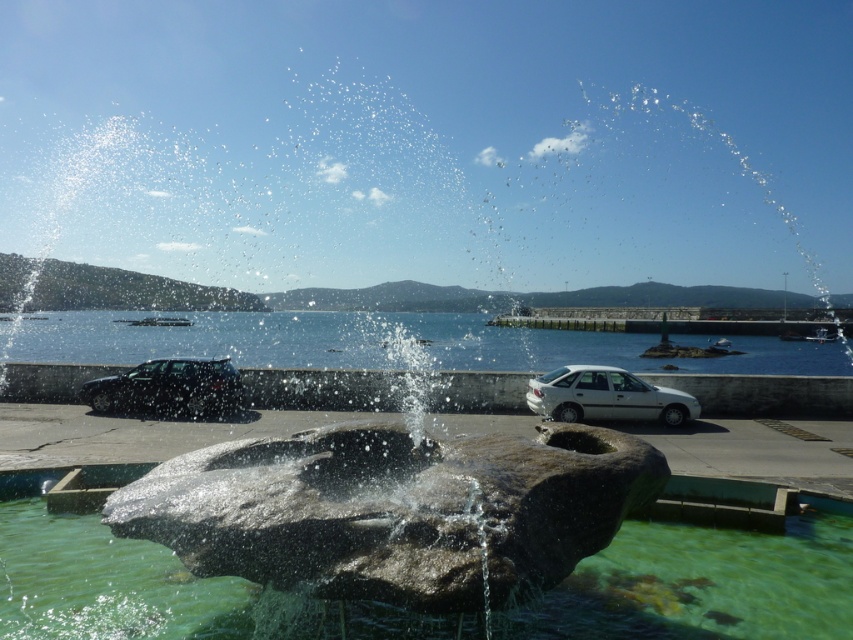
Is the position of rough stone fountain at center more distant than that of clear stone water at center?

Yes, rough stone fountain at center is behind clear stone water at center.

Who is more forward, (242, 486) or (149, 557)?

Point (242, 486)

Does point (486, 506) lie behind point (714, 586)?

No, it is in front of (714, 586).

Identify the location of rough stone fountain at center. This screenshot has height=640, width=853. (393, 509).

Who is more forward, [323,577] or [100,385]?

Positioned in front is point [323,577].

I want to click on rough stone fountain at center, so click(393, 509).

Can you confirm if rough stone fountain at center is bigger than silver metallic car at center?

No, rough stone fountain at center is not bigger than silver metallic car at center.

Is rough stone fountain at center shorter than silver metallic car at center?

Correct, rough stone fountain at center is not as tall as silver metallic car at center.

In order to click on rough stone fountain at center in this screenshot , I will do `click(393, 509)`.